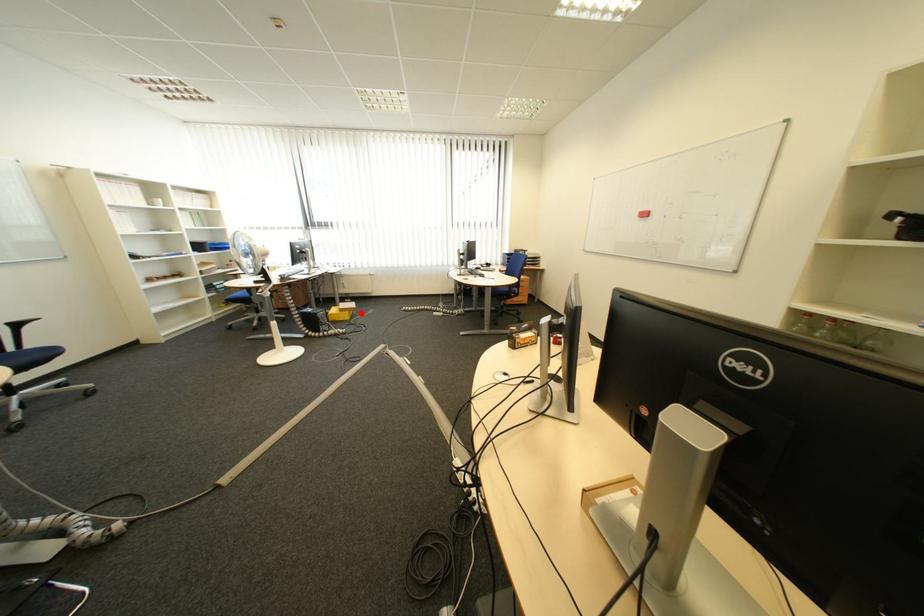
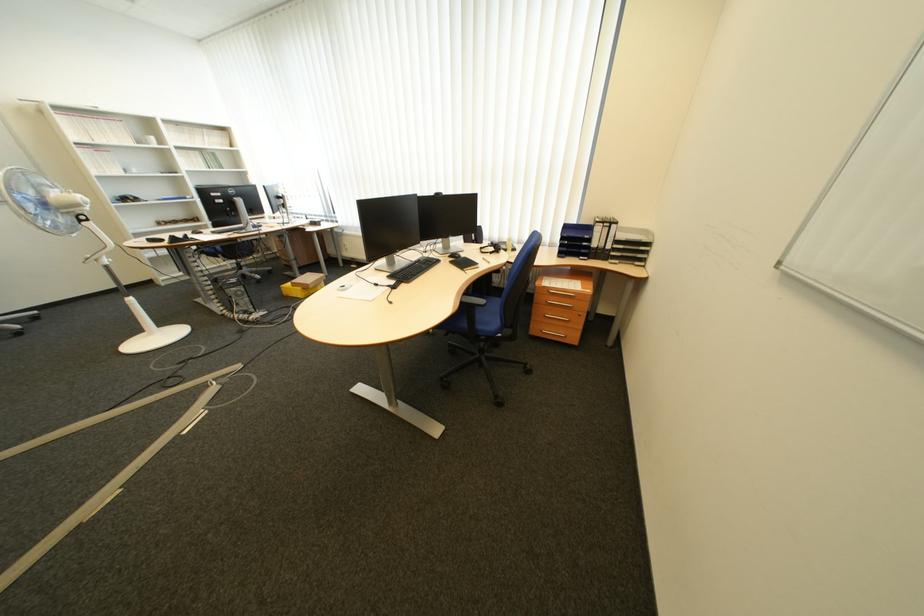
The point at the highlighted location is marked in the first image. Where is the corresponding point in the second image?

(313, 290)